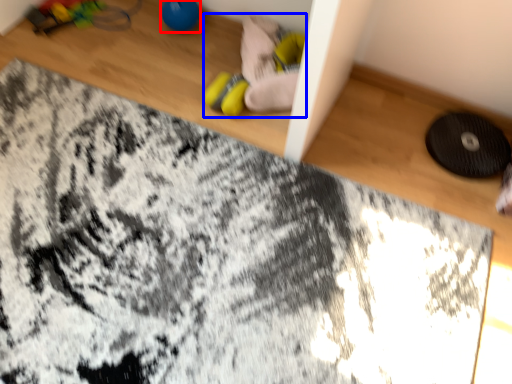
Question: Which point is further to the camera, toy (highlighted by a red box) or toy (highlighted by a blue box)?

Choices:
 (A) toy
 (B) toy

Answer: (A)